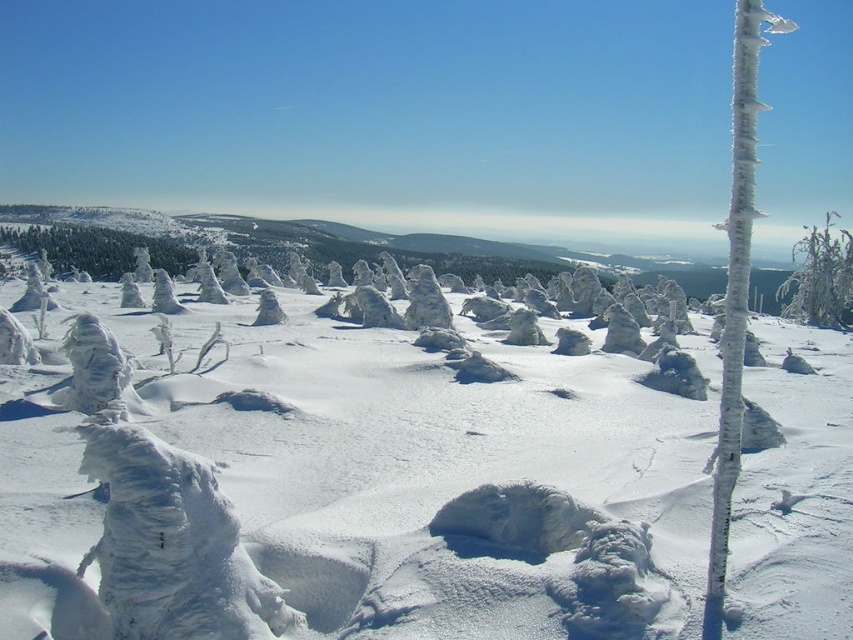
You are standing in the snowy landscape and want to walk from the white frosty trees at center to the icy white tree at right. Which direction should you head?

You should head to the right because the white frosty trees at center are to the left of the icy white tree at right.

You are standing at the origin point in the winter landscape. You want to reach the white frosty trees at center. Which direction should you move in to get there?

The white frosty trees at center are located at coordinates point (347, 492), so you should move towards the right and slightly forward to reach them.

You are standing in the winter landscape and see the white frosty trees at center and the white frosty tree at left. Which tree is located to the right of the other?

The white frosty trees at center is positioned on the right side of white frosty tree at left.